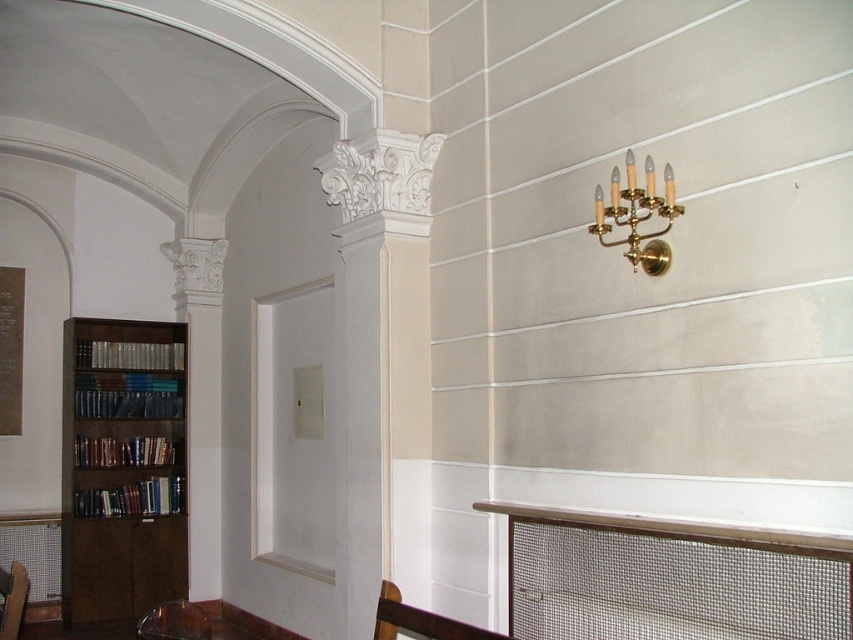
Question: Is dark brown wood bookcase at left in front of gold polished brass chandelier at upper right?

Choices:
 (A) yes
 (B) no

Answer: (B)

Question: Which of the following is the closest to the observer?

Choices:
 (A) (108, 470)
 (B) (3, 616)
 (C) (618, 225)
 (D) (397, 621)

Answer: (D)

Question: Which is nearer to the gold polished brass chandelier at upper right?

Choices:
 (A) brown wooden chair at lower center
 (B) wooden chair at lower left

Answer: (A)

Question: Does brown wooden chair at lower center have a lesser width compared to wooden chair at lower left?

Choices:
 (A) no
 (B) yes

Answer: (A)

Question: Does dark brown wood bookcase at left have a smaller size compared to wooden chair at lower left?

Choices:
 (A) yes
 (B) no

Answer: (B)

Question: Which object appears closest to the camera in this image?

Choices:
 (A) brown wooden chair at lower center
 (B) dark brown wood bookcase at left

Answer: (A)